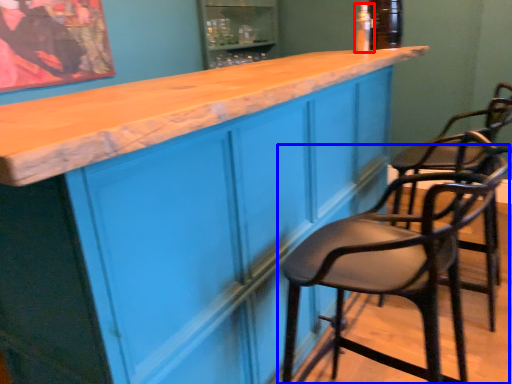
Question: Which point is closer to the camera, bottle (highlighted by a red box) or chair (highlighted by a blue box)?

Choices:
 (A) bottle
 (B) chair

Answer: (B)